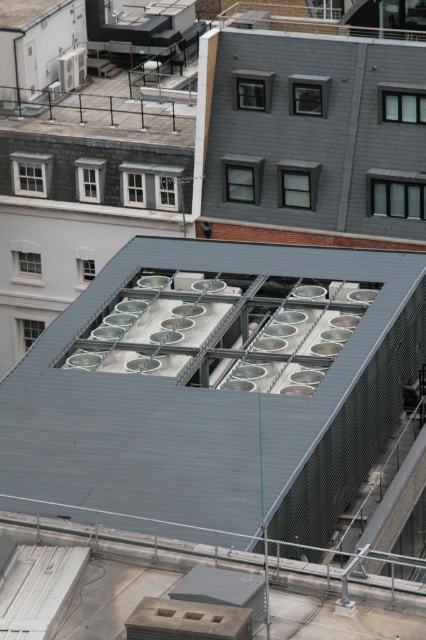
Question: Which point is closer to the camera?

Choices:
 (A) metallic gray roof at center
 (B) gray matte roof at upper center

Answer: (A)

Question: In this image, where is metallic gray roof at center located relative to gray matte roof at upper center?

Choices:
 (A) left
 (B) right

Answer: (A)

Question: Is metallic gray roof at center above gray matte roof at upper center?

Choices:
 (A) no
 (B) yes

Answer: (A)

Question: Can you confirm if metallic gray roof at center is smaller than gray matte roof at upper center?

Choices:
 (A) yes
 (B) no

Answer: (B)